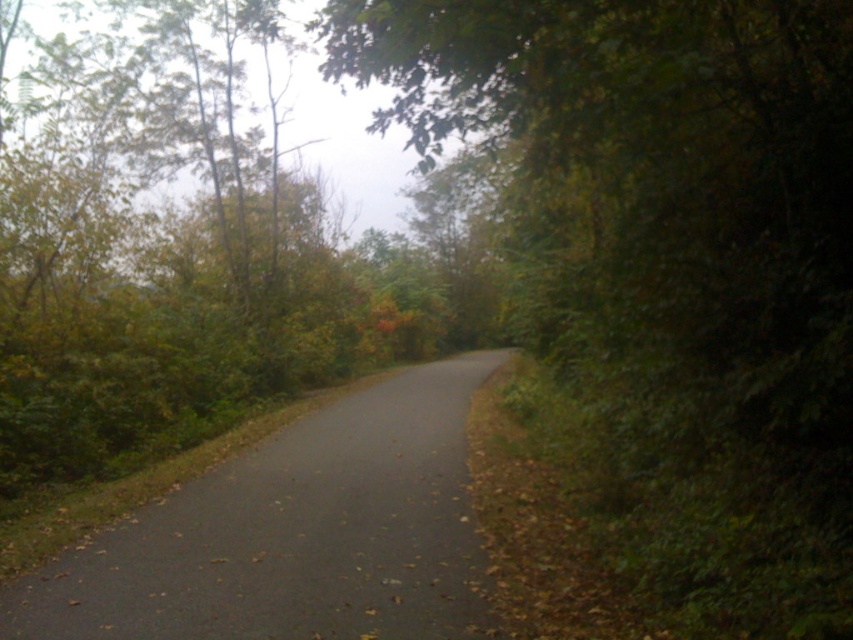
Question: Considering the relative positions of green leafy tree at center and black asphalt road at center in the image provided, where is green leafy tree at center located with respect to black asphalt road at center?

Choices:
 (A) left
 (B) right

Answer: (B)

Question: Does green leafy tree at center have a larger size compared to black asphalt road at center?

Choices:
 (A) yes
 (B) no

Answer: (A)

Question: Among these objects, which one is farthest from the camera?

Choices:
 (A) black asphalt road at center
 (B) green leafy tree at center

Answer: (A)

Question: Can you confirm if green leafy tree at center is positioned above black asphalt road at center?

Choices:
 (A) no
 (B) yes

Answer: (B)